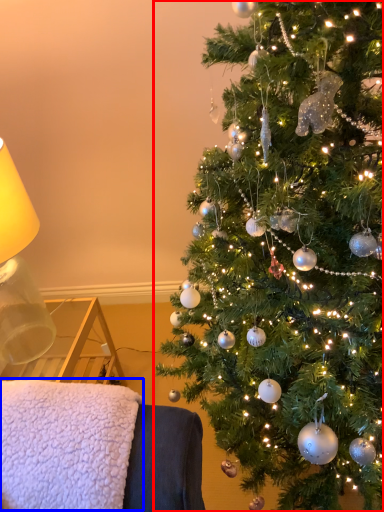
Question: Among these objects, which one is nearest to the camera, christmas tree (highlighted by a red box) or blanket (highlighted by a blue box)?

Choices:
 (A) christmas tree
 (B) blanket

Answer: (A)